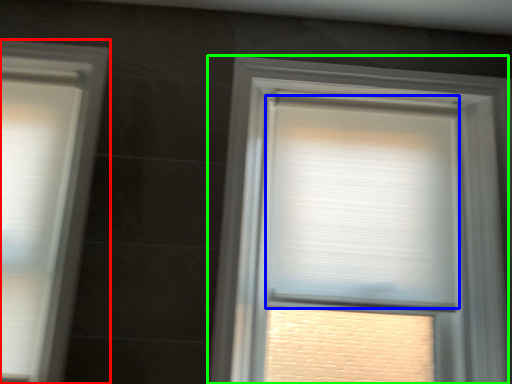
Question: Which is nearer to the window (highlighted by a red box)? window blind (highlighted by a blue box) or window (highlighted by a green box).

Choices:
 (A) window blind
 (B) window

Answer: (B)